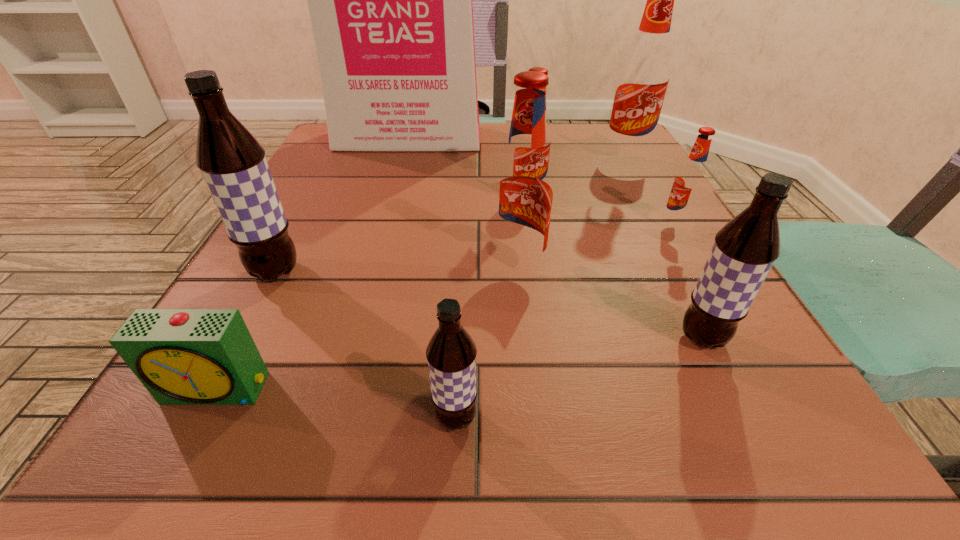
Choose which object is the seventh nearest neighbor to the seventh farthest object. Please provide its 2D coordinates. Your answer should be formatted as a tuple, i.e. [(x, y)], where the tuple contains the x and y coordinates of a point satisfying the conditions above.

[(233, 164)]

Locate an element on the screen. The height and width of the screenshot is (540, 960). root beer that stands as the sixth closest to the seventh nearest object is located at coordinates (451, 353).

Identify which root beer is the nearest to the shortest object. Please provide its 2D coordinates. Your answer should be formatted as a tuple, i.e. [(x, y)], where the tuple contains the x and y coordinates of a point satisfying the conditions above.

[(233, 164)]

The height and width of the screenshot is (540, 960). Identify the location of the third closest red root beer relative to the leftmost brown root beer. (689, 183).

Identify the location of red root beer that stands as the third closest to the biggest red root beer. (523, 191).

Where is `the third closest brown root beer relative to the second biggest red root beer`? The image size is (960, 540). the third closest brown root beer relative to the second biggest red root beer is located at coordinates (233, 164).

Choose which brown root beer is the nearest neighbor to the green alarm clock. Please provide its 2D coordinates. Your answer should be formatted as a tuple, i.e. [(x, y)], where the tuple contains the x and y coordinates of a point satisfying the conditions above.

[(233, 164)]

Locate an element on the screen. free point that satisfies the following two spatial constraints: 1. on the front side of the second nearest red root beer; 2. on the left side of the tallest root beer is located at coordinates point(662,225).

At what (x,y) coordinates should I click in order to perform the action: click on free space that satisfies the following two spatial constraints: 1. on the front-facing side of the tallest object; 2. on the right side of the farthest red root beer. Please return your answer as a coordinate pair (x, y). Image resolution: width=960 pixels, height=540 pixels. Looking at the image, I should click on (403, 157).